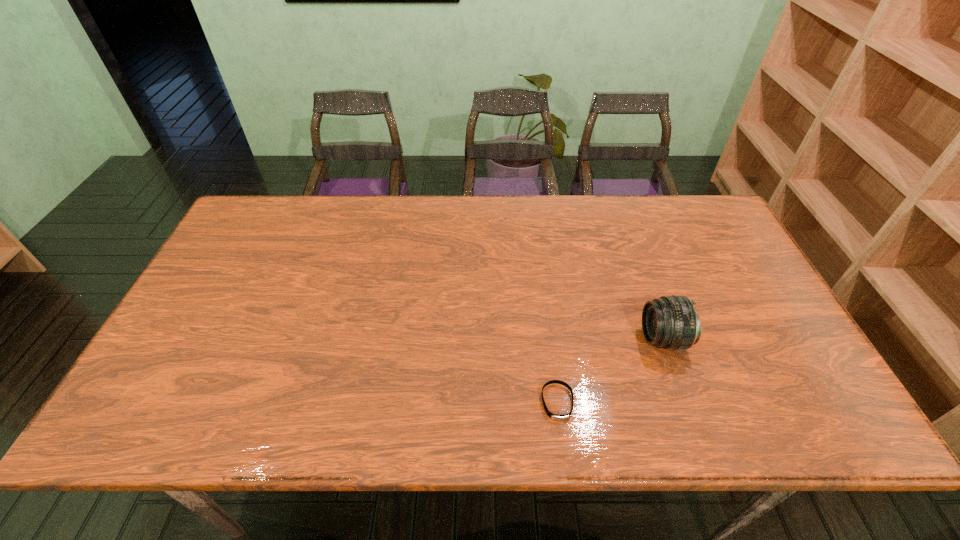
Image resolution: width=960 pixels, height=540 pixels. In the image, there is a desktop. What are the coordinates of `vacant space at the right edge` in the screenshot? It's located at (759, 356).

At what (x,y) coordinates should I click in order to perform the action: click on vacant space at the far left corner. Please return your answer as a coordinate pair (x, y). The height and width of the screenshot is (540, 960). Looking at the image, I should click on (264, 215).

In the image, there is a desktop. Identify the location of vacant space at the far right corner. This screenshot has height=540, width=960. click(x=701, y=202).

Identify the location of vacant position in the image that satisfies the following two spatial constraints: 1. at the front element of the farther object; 2. on the display of the shorter object. (685, 402).

Where is `free region that satisfies the following two spatial constraints: 1. at the front element of the telephoto lens; 2. on the display of the wristband`? This screenshot has width=960, height=540. free region that satisfies the following two spatial constraints: 1. at the front element of the telephoto lens; 2. on the display of the wristband is located at coordinates (685, 402).

Identify the location of free space that satisfies the following two spatial constraints: 1. at the front element of the taller object; 2. on the display of the left object. (685, 402).

Where is `vacant space that satisfies the following two spatial constraints: 1. at the front element of the farther object; 2. on the display of the left object`? vacant space that satisfies the following two spatial constraints: 1. at the front element of the farther object; 2. on the display of the left object is located at coordinates (685, 402).

Identify the location of free point that satisfies the following two spatial constraints: 1. at the front element of the farther object; 2. on the display of the shorter object. Image resolution: width=960 pixels, height=540 pixels. (685, 402).

The width and height of the screenshot is (960, 540). What are the coordinates of `free space that satisfies the following two spatial constraints: 1. at the front element of the right object; 2. on the display of the wristband` in the screenshot? It's located at (685, 402).

Identify the location of free space that satisfies the following two spatial constraints: 1. at the front element of the farther object; 2. on the display of the shorter object. This screenshot has width=960, height=540. (685, 402).